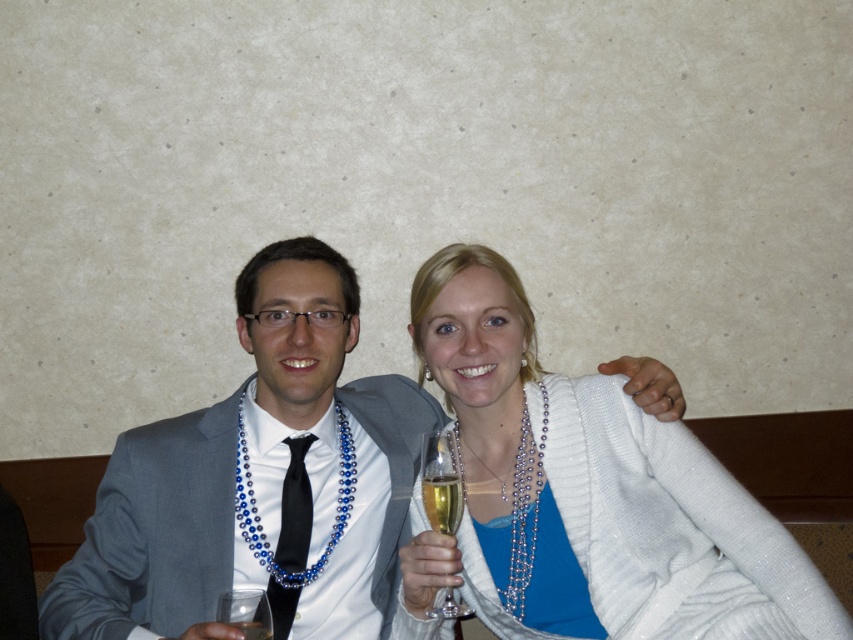
You are at a formal event and need to pour wine into the correct glass. According to the image, which glass should you choose between the clear glass wine glass at center and the translucent glass at center?

The clear glass wine glass at center is to the right of the translucent glass at center, so you should choose the clear glass wine glass at center for pouring wine since it is positioned correctly to the right.

Please describe the position of the black satin tie at center in the image using the coordinate system provided. The coordinate system has its origin at the bottom left corner of the image, with the x and y axes increasing to the right and upward respectively. The coordinates are given as a decimal fraction between 0 and 1, where 1 represents the full width or height of the image. For example, a point at the center would be at coordinates approximately 0.5, 0.5.

The black satin tie at center is located at coordinates point (294, 508).

You are a photographer setting up for an event and need to place a small decorative item between the white glittery sweater at upper right and the clear glass wine glass at center. Based on their heights, which object should the item be placed closer to?

The white glittery sweater at upper right is taller than the clear glass wine glass at center, so the decorative item should be placed closer to the clear glass wine glass at center to maintain balance.